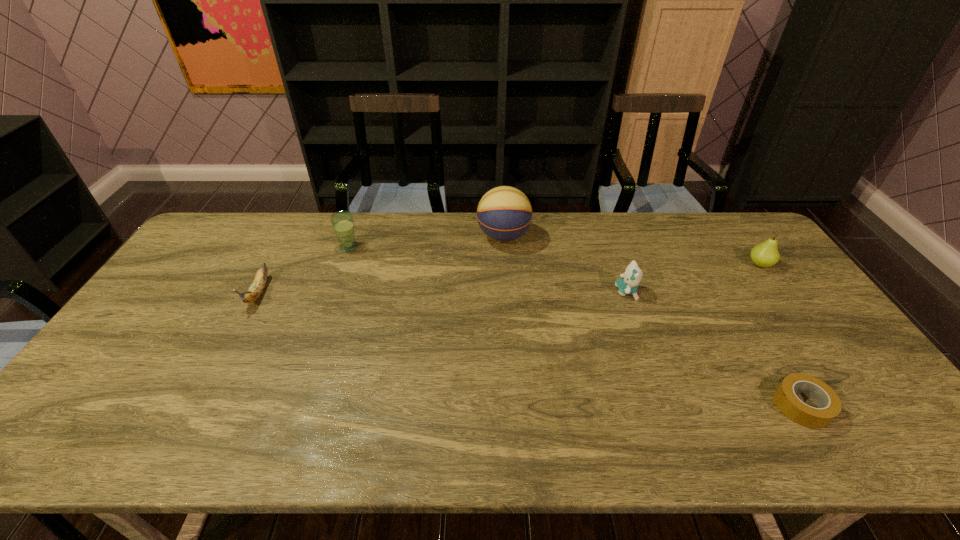
Identify the location of unoccupied area between the leftmost object and the pear. The height and width of the screenshot is (540, 960). (510, 279).

Locate an element on the screen. The width and height of the screenshot is (960, 540). free spot between the leftmost object and the fourth nearest object is located at coordinates (510, 279).

Image resolution: width=960 pixels, height=540 pixels. In order to click on free area in between the fourth object from left to right and the duct tape in this screenshot , I will do click(713, 348).

Find the location of a particular element. object identified as the fifth closest to the third farthest object is located at coordinates (254, 292).

Locate which object is the second closest to the fifth object from left to right. Please provide its 2D coordinates. Your answer should be formatted as a tuple, i.e. [(x, y)], where the tuple contains the x and y coordinates of a point satisfying the conditions above.

[(766, 254)]

The image size is (960, 540). I want to click on vacant area that satisfies the following two spatial constraints: 1. on the patterned surface of the tallest object; 2. on the left side of the rightmost object, so click(x=505, y=265).

Locate an element on the screen. This screenshot has height=540, width=960. vacant space that satisfies the following two spatial constraints: 1. on the patterned surface of the basketball; 2. on the peel of the banana is located at coordinates (507, 293).

Where is `vacant space that satisfies the following two spatial constraints: 1. on the front side of the rightmost object; 2. on the left side of the glass`? vacant space that satisfies the following two spatial constraints: 1. on the front side of the rightmost object; 2. on the left side of the glass is located at coordinates coord(343,265).